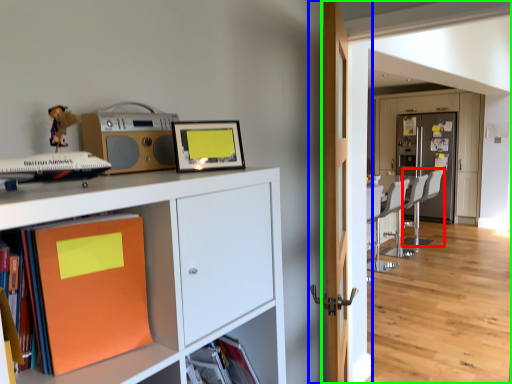
Question: Based on their relative distances, which object is nearer to swivel chair (highlighted by a red box)? Choose from door (highlighted by a blue box) and corridor (highlighted by a green box).

Choices:
 (A) door
 (B) corridor

Answer: (B)